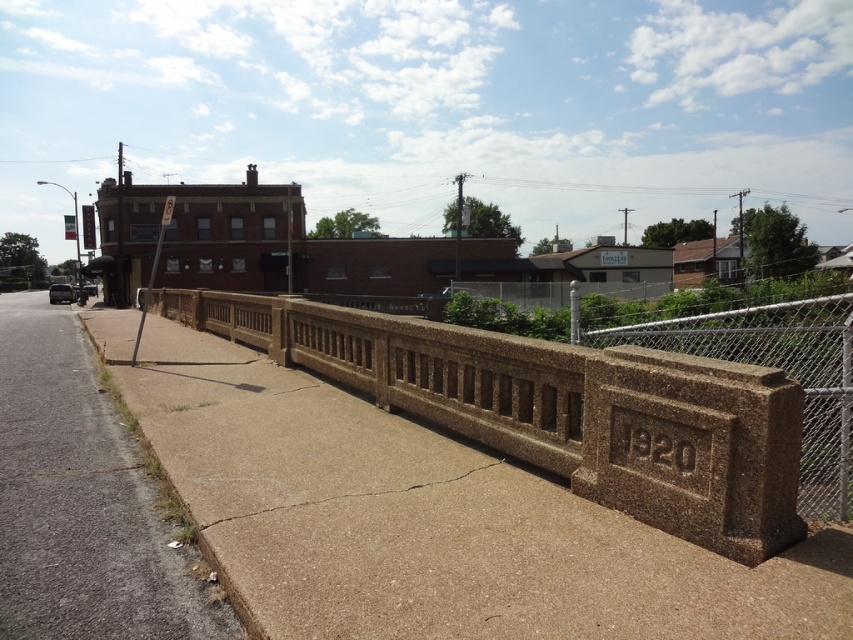
You are a delivery person needing to place a package on the gray concrete sidewalk at lower left. The package is 3 meters long. Can you safely place it entirely on the brown textured concrete at center without exceeding its length? Explain why.

The brown textured concrete at center is 3.09 meters away from the gray concrete sidewalk at lower left. Since the package is 3 meters long, it can be placed entirely on the brown textured concrete at center as the distance between them allows for the package to fit without exceeding its length.

You are standing on the gray concrete sidewalk at lower left and want to walk to the brown textured concrete at center. Which direction should you move to reach it?

To reach the brown textured concrete at center from the gray concrete sidewalk at lower left, you should move to the right since the brown textured concrete at center is positioned on the right side of the gray concrete sidewalk at lower left.